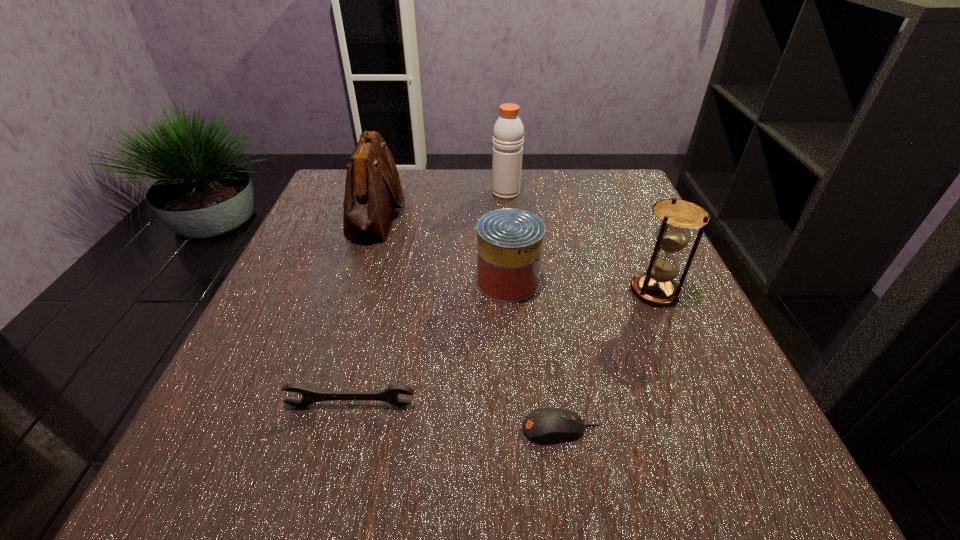
Where is `shaker`? Image resolution: width=960 pixels, height=540 pixels. shaker is located at coordinates (508, 133).

Locate an element on the screen. The image size is (960, 540). shoulder bag is located at coordinates (372, 189).

Image resolution: width=960 pixels, height=540 pixels. Find the location of `the rightmost object`. the rightmost object is located at coordinates (656, 286).

The height and width of the screenshot is (540, 960). I want to click on the third shortest object, so click(x=510, y=241).

Find the location of a particular element. Image resolution: width=960 pixels, height=540 pixels. wrench is located at coordinates (389, 395).

The height and width of the screenshot is (540, 960). I want to click on the fifth tallest object, so click(x=389, y=395).

Locate an element on the screen. This screenshot has height=540, width=960. the shortest object is located at coordinates click(x=548, y=424).

Identify the location of the nearest object. The image size is (960, 540). (548, 424).

Where is `vacant space located on the left of the shaker`? The width and height of the screenshot is (960, 540). vacant space located on the left of the shaker is located at coordinates (383, 192).

What are the coordinates of `free spot located 0.070m on the back of the shoulder bag` in the screenshot? It's located at (390, 171).